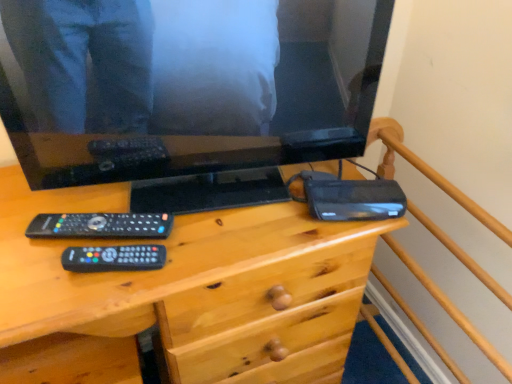
Question: Is black matte router at right not within wooden desk at center?

Choices:
 (A) no
 (B) yes

Answer: (A)

Question: Does black matte router at right appear on the right side of wooden desk at center?

Choices:
 (A) yes
 (B) no

Answer: (A)

Question: From the image's perspective, does black matte router at right appear lower than wooden desk at center?

Choices:
 (A) no
 (B) yes

Answer: (A)

Question: Is black matte router at right positioned behind wooden desk at center?

Choices:
 (A) yes
 (B) no

Answer: (A)

Question: Is black matte router at right shorter than wooden desk at center?

Choices:
 (A) yes
 (B) no

Answer: (A)

Question: Is wooden bed frame at upper right inside or outside of wooden desk at center?

Choices:
 (A) outside
 (B) inside

Answer: (A)

Question: Based on their positions, is wooden bed frame at upper right located to the left or right of wooden desk at center?

Choices:
 (A) right
 (B) left

Answer: (A)

Question: In terms of width, does wooden bed frame at upper right look wider or thinner when compared to wooden desk at center?

Choices:
 (A) wide
 (B) thin

Answer: (B)

Question: Based on their sizes in the image, would you say wooden bed frame at upper right is bigger or smaller than wooden desk at center?

Choices:
 (A) big
 (B) small

Answer: (B)

Question: From their relative heights in the image, would you say black matte router at right is taller or shorter than black glossy television at upper center?

Choices:
 (A) short
 (B) tall

Answer: (A)

Question: Is black matte router at right inside or outside of black glossy television at upper center?

Choices:
 (A) outside
 (B) inside

Answer: (A)

Question: Considering the positions of black matte router at right and black glossy television at upper center in the image, is black matte router at right bigger or smaller than black glossy television at upper center?

Choices:
 (A) big
 (B) small

Answer: (B)

Question: Is black matte router at right to the left or to the right of black glossy television at upper center in the image?

Choices:
 (A) left
 (B) right

Answer: (B)

Question: Based on their sizes in the image, would you say black glossy television at upper center is bigger or smaller than wooden desk at center?

Choices:
 (A) big
 (B) small

Answer: (B)

Question: Relative to wooden desk at center, is black glossy television at upper center in front or behind?

Choices:
 (A) front
 (B) behind

Answer: (B)